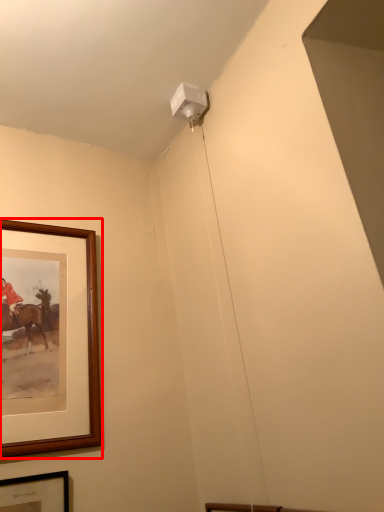
Question: From the image, what is the correct spatial relationship of picture frame (annotated by the red box) in relation to picture frame?

Choices:
 (A) right
 (B) left

Answer: (A)